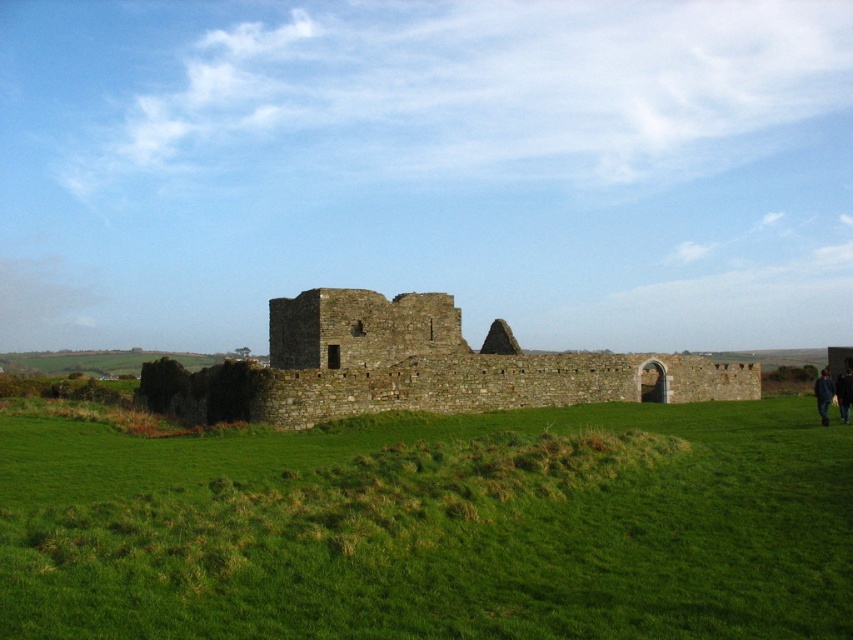
Does point (601, 371) lie behind point (846, 397)?

Yes.

Can you confirm if brown stone ruins at center is positioned to the right of dark blue fabric at lower right?

Incorrect, brown stone ruins at center is not on the right side of dark blue fabric at lower right.

Who is more forward, (x=514, y=349) or (x=851, y=376)?

Positioned in front is point (x=851, y=376).

The width and height of the screenshot is (853, 640). Find the location of `brown stone ruins at center`. brown stone ruins at center is located at coordinates (415, 368).

Is dark blue jacket at lower right thinner than dark blue fabric at lower right?

No, dark blue jacket at lower right is not thinner than dark blue fabric at lower right.

Does dark blue jacket at lower right lie in front of dark blue fabric at lower right?

Yes.

Image resolution: width=853 pixels, height=640 pixels. What do you see at coordinates (822, 394) in the screenshot?
I see `dark blue jacket at lower right` at bounding box center [822, 394].

I want to click on dark blue jacket at lower right, so click(822, 394).

Is green grassy hill at center further to camera compared to brown stone ruins at center?

No, green grassy hill at center is closer to the viewer.

Between green grassy hill at center and brown stone ruins at center, which one is positioned higher?

brown stone ruins at center

Between point (196, 480) and point (337, 307), which one is positioned in front?

Point (196, 480)

Where is `green grassy hill at center`? Image resolution: width=853 pixels, height=640 pixels. green grassy hill at center is located at coordinates (434, 525).